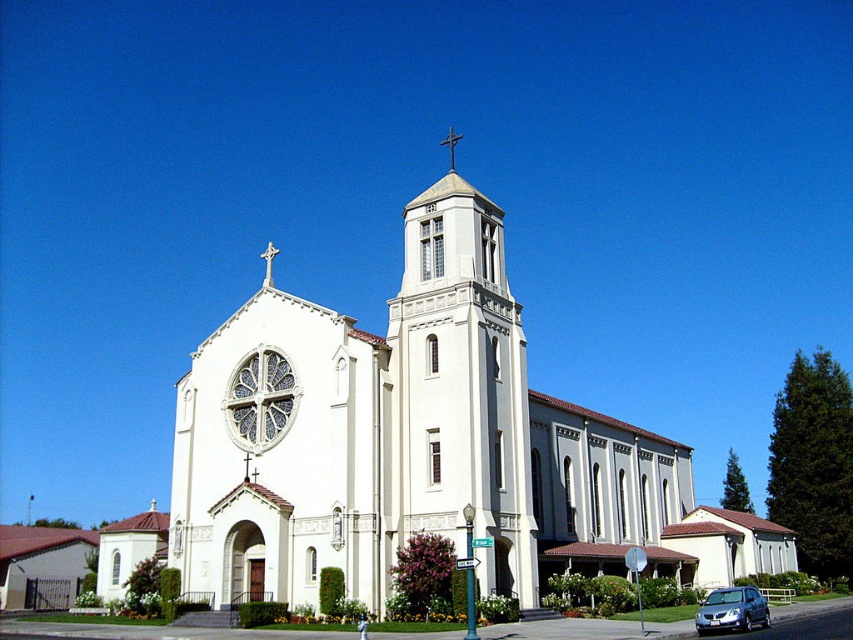
You are a visitor arriving at the church and want to park your car in the parking area near the entrance. You see the white smooth steeple at center and the satin silver sedan at lower right. Which car is closer to the entrance of the church?

The satin silver sedan at lower right is behind the white smooth steeple at center, so the white smooth steeple at center is closer to the entrance of the church than the satin silver sedan at lower right.

You are a photographer planning to take a picture of the church. You want to ensure both the white smooth steeple at center and the metallic cross at upper center are clearly visible. Considering their sizes, which object should you focus on first to ensure both are in frame?

The white smooth steeple at center is larger in size than the metallic cross at upper center. Therefore, focusing on the white smooth steeple at center first will ensure both are in frame since it occupies more space, making it easier to position the camera accordingly.